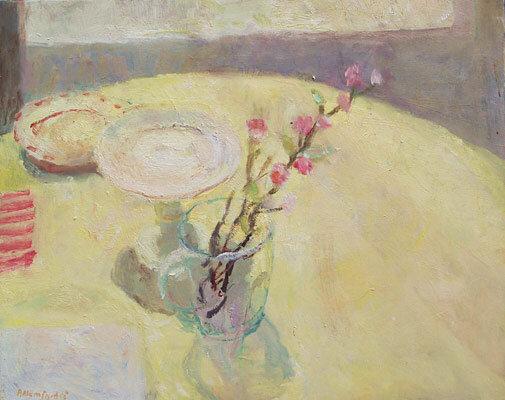
Where is `napkin`? This screenshot has height=400, width=505. napkin is located at coordinates (17, 209), (17, 234), (17, 248).